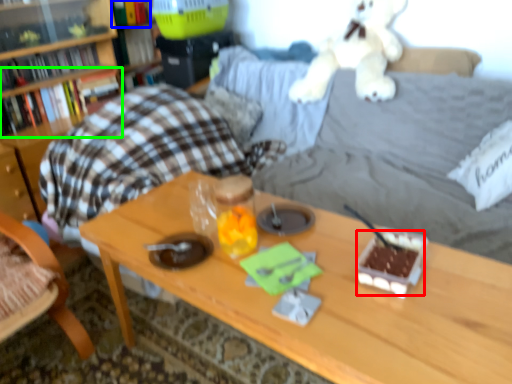
Question: Based on their relative distances, which object is nearer to food (highlighted by a red box)? Choose from book (highlighted by a blue box) and book (highlighted by a green box).

Choices:
 (A) book
 (B) book

Answer: (B)